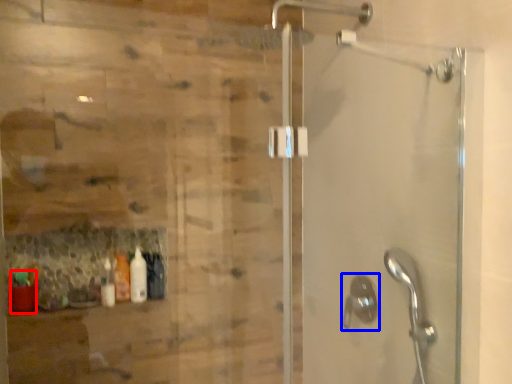
Question: Which point is further to the camera, bottle (highlighted by a red box) or shower (highlighted by a blue box)?

Choices:
 (A) bottle
 (B) shower

Answer: (A)